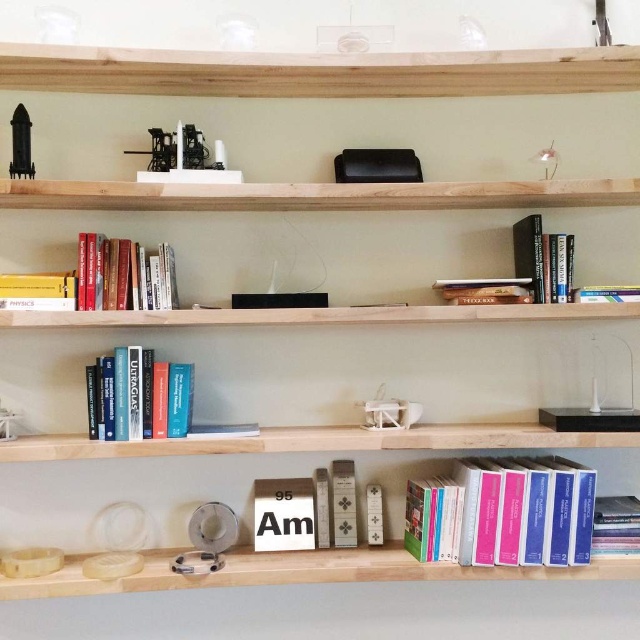
From the picture: You are an interior designer arranging items on a shelf. You have a blue hardcover books at center and a hardcover book at upper center. Which one has a wider width?

The blue hardcover books at center has a larger width than the hardcover book at upper center.

You are standing in front of the wooden shelving unit and want to place a new book exactly where the hardcover books at upper left are located. What are the coordinates of that location?

The coordinates of the hardcover books at upper left are at point (99, 280).

You are standing in front of the wooden shelving unit and want to reach two points marked on the shelves. The first point is at coordinate point(x=525, y=474) and the second is at point(x=128, y=280). Which point should you reach first if you want to touch them in the order from closest to farthest from you?

Point(x=525, y=474) is in front of point(x=128, y=280), so you should reach point(x=525, y=474) first as it is closer to you.